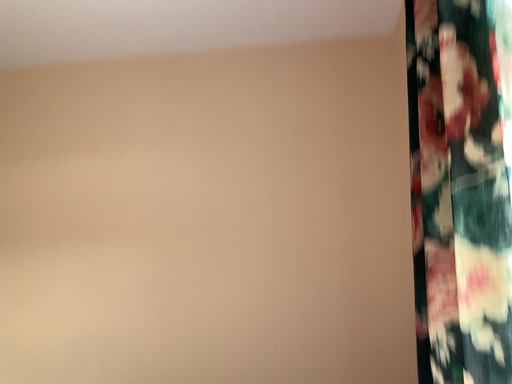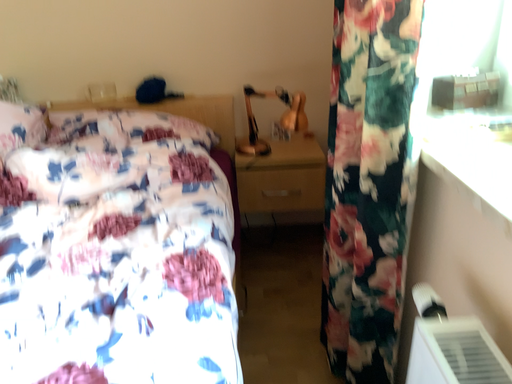
Question: Which way did the camera rotate in the video?

Choices:
 (A) rotated left
 (B) rotated right

Answer: (B)